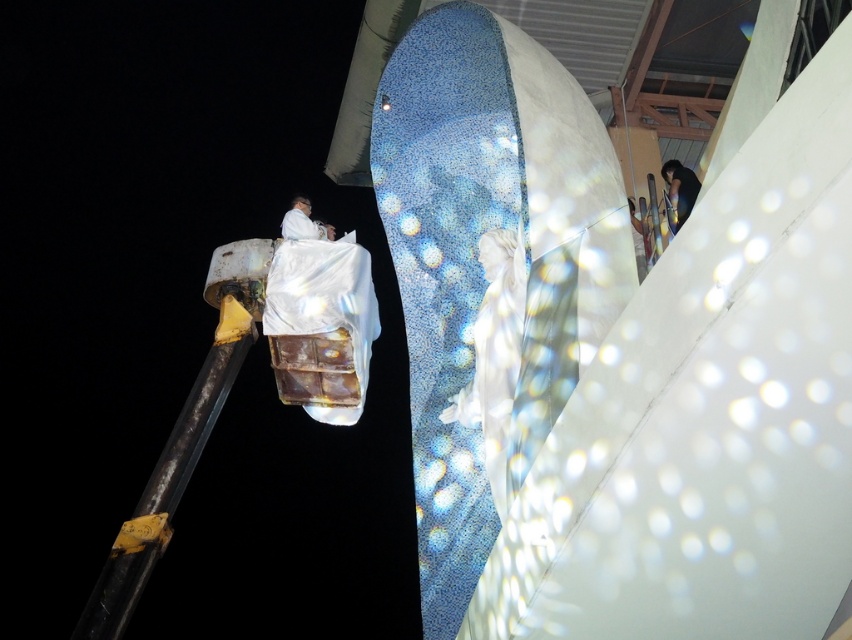
Consider the image. Who is more forward, (105,563) or (689,192)?

Point (105,563) is in front.

Who is positioned more to the left, rusty metal pole at left or dark hair at upper right?

From the viewer's perspective, rusty metal pole at left appears more on the left side.

Is point (137, 529) positioned before point (671, 205)?

Yes, point (137, 529) is in front of point (671, 205).

Where is `rusty metal pole at left`? The width and height of the screenshot is (852, 640). rusty metal pole at left is located at coordinates (167, 481).

Which is more to the right, rusty metal pole at left or white glossy statue at center?

From the viewer's perspective, white glossy statue at center appears more on the right side.

Which is above, rusty metal pole at left or white glossy statue at center?

white glossy statue at center is higher up.

Is point (124, 627) closer to camera compared to point (516, 273)?

No, it is not.

At what (x,y) coordinates should I click in order to perform the action: click on rusty metal pole at left. Please return your answer as a coordinate pair (x, y). This screenshot has height=640, width=852. Looking at the image, I should click on (167, 481).

Consider the image. Is dark hair at upper right taller than white matte suit at upper center?

Correct, dark hair at upper right is much taller as white matte suit at upper center.

Is point (675, 193) positioned behind point (326, 236)?

No.

Where is `dark hair at upper right`? The height and width of the screenshot is (640, 852). dark hair at upper right is located at coordinates (678, 189).